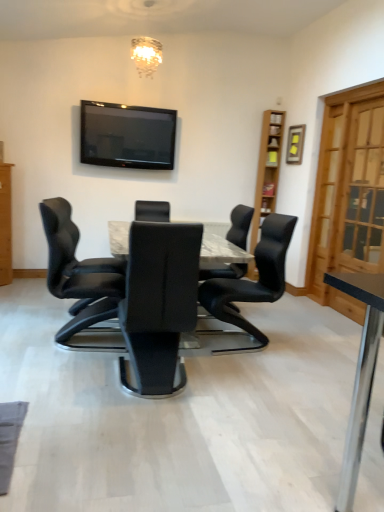
Question: Is marble table at center inside light brown wooden cabinet at left?

Choices:
 (A) yes
 (B) no

Answer: (B)

Question: From a real-world perspective, is light brown wooden cabinet at left physically below marble table at center?

Choices:
 (A) no
 (B) yes

Answer: (A)

Question: Is light brown wooden cabinet at left looking in the opposite direction of marble table at center?

Choices:
 (A) no
 (B) yes

Answer: (A)

Question: Is light brown wooden cabinet at left in contact with marble table at center?

Choices:
 (A) yes
 (B) no

Answer: (B)

Question: Is light brown wooden cabinet at left at the right side of marble table at center?

Choices:
 (A) no
 (B) yes

Answer: (A)

Question: From the image's perspective, is flat-screen black at upper center located above or below marble table at center?

Choices:
 (A) below
 (B) above

Answer: (B)

Question: Relative to marble table at center, is flat-screen black at upper center in front or behind?

Choices:
 (A) front
 (B) behind

Answer: (B)

Question: From a real-world perspective, is flat-screen black at upper center above or below marble table at center?

Choices:
 (A) above
 (B) below

Answer: (A)

Question: Based on their sizes in the image, would you say flat-screen black at upper center is bigger or smaller than marble table at center?

Choices:
 (A) small
 (B) big

Answer: (A)

Question: From the image's perspective, is flat-screen black at upper center above or below black leather chair at center, which is the first chair from right to left?

Choices:
 (A) above
 (B) below

Answer: (A)

Question: Is flat-screen black at upper center wider or thinner than black leather chair at center, the third chair when ordered from left to right?

Choices:
 (A) thin
 (B) wide

Answer: (A)

Question: Is flat-screen black at upper center inside or outside of black leather chair at center, the third chair when ordered from left to right?

Choices:
 (A) inside
 (B) outside

Answer: (B)

Question: Considering their positions, is flat-screen black at upper center located in front of or behind black leather chair at center, the third chair when ordered from left to right?

Choices:
 (A) front
 (B) behind

Answer: (B)

Question: Is black leather chair at center, acting as the 2th chair starting from the right, to the left or to the right of light brown wooden cabinet at left in the image?

Choices:
 (A) right
 (B) left

Answer: (A)

Question: Looking at the image, does black leather chair at center, acting as the 2th chair starting from the right, seem bigger or smaller compared to light brown wooden cabinet at left?

Choices:
 (A) small
 (B) big

Answer: (B)